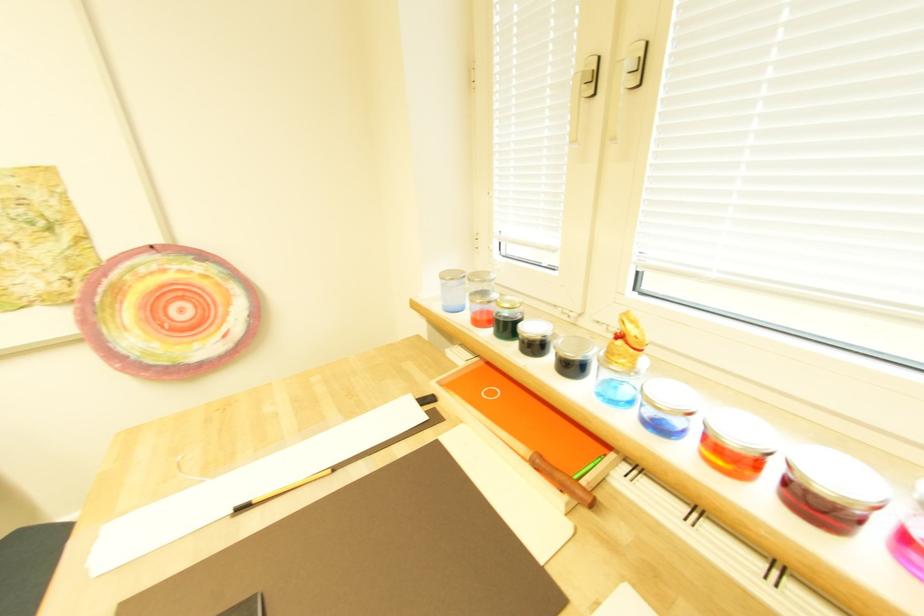
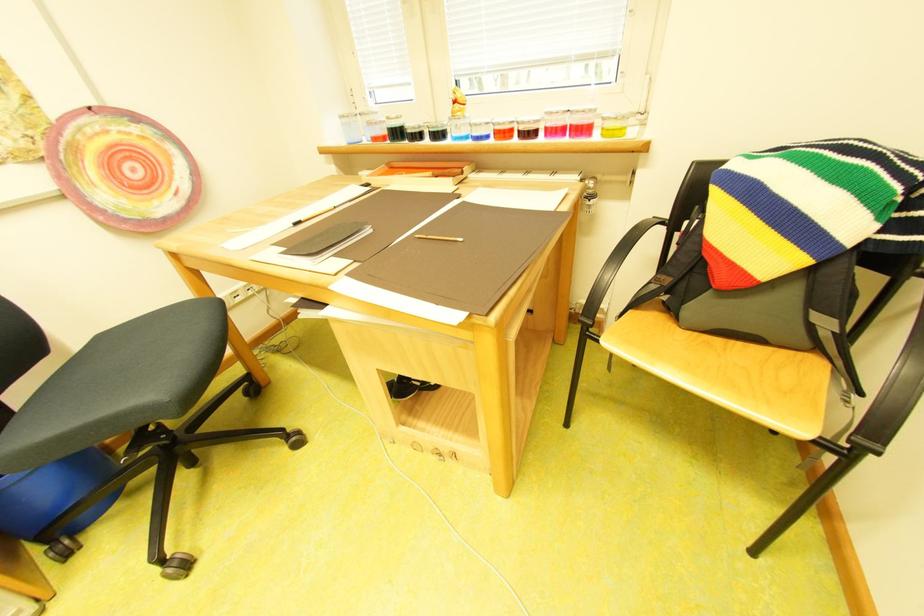
In the second image, find the point that corresponds to point (621, 354) in the first image.

(465, 115)